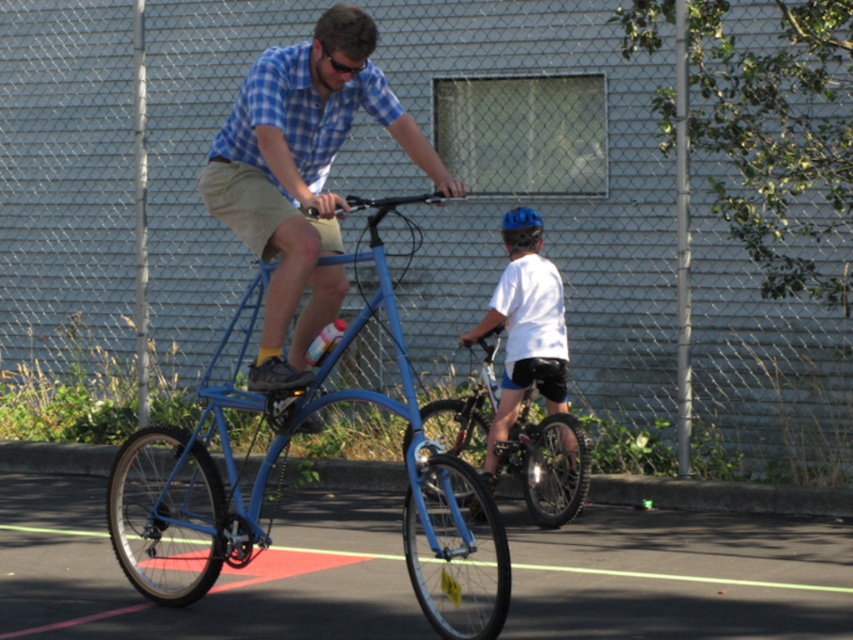
You are a photographer trying to capture a photo of the two cyclists. You want to ensure both the white matte shirt at center and the blue matte bicycle helmet at upper center are clearly visible in the frame. Based on their positions, which object should you focus on first to ensure both are in focus?

Since the white matte shirt at center might be wider than the blue matte bicycle helmet at upper center, you should focus on the white matte shirt at center first because wider objects often require more precise focusing to ensure clarity across their entire surface.

You are standing at the origin point of the coordinate system. You see a point labeled as point (x=302, y=173). What object is located at that point?

The point (x=302, y=173) corresponds to the matte blue bicycle at center.

You are a photographer standing at the edge of the paved area. You want to take a photo that includes both the matte blue bicycle at center and the white matte shirt at center. Which object should you focus on first if you want to ensure both are in the frame?

The matte blue bicycle at center is not as tall as the white matte shirt at center, so you should focus on the white matte shirt at center first to ensure the entire height of both objects fits within the frame.